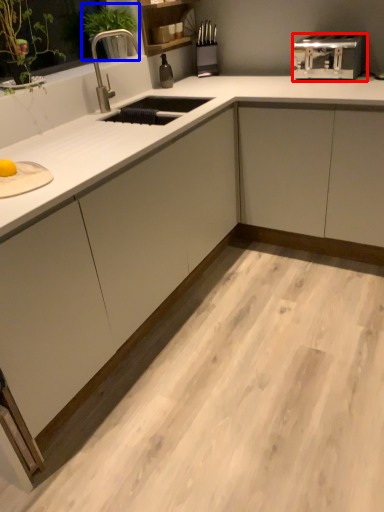
Question: Among these objects, which one is nearest to the camera, toaster (highlighted by a red box) or plant (highlighted by a blue box)?

Choices:
 (A) toaster
 (B) plant

Answer: (A)